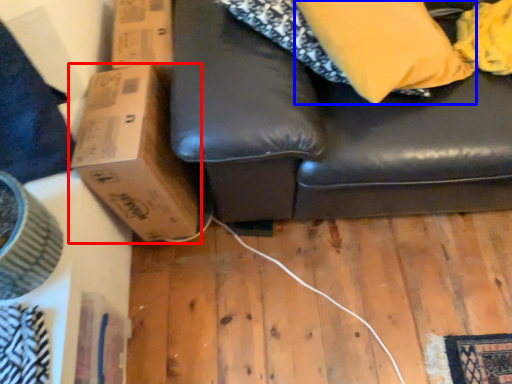
Question: Which point is further to the camera, cardboard box (highlighted by a red box) or pillow (highlighted by a blue box)?

Choices:
 (A) cardboard box
 (B) pillow

Answer: (A)